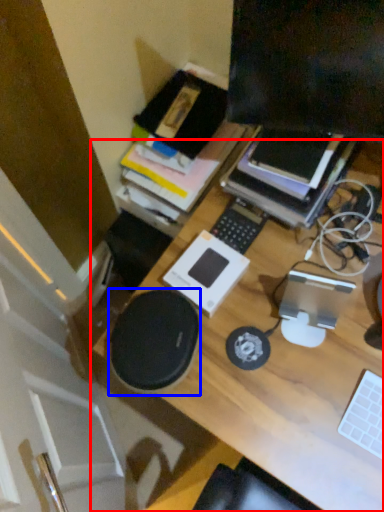
Question: Which point is closer to the camera, desk (highlighted by a red box) or speaker (highlighted by a blue box)?

Choices:
 (A) desk
 (B) speaker

Answer: (A)